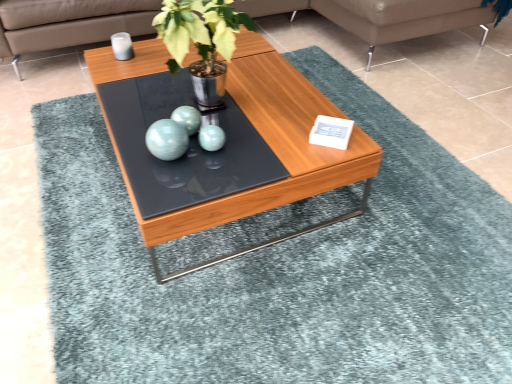
Where is `free point behind teal glossy sphere at center`? free point behind teal glossy sphere at center is located at coordinates [x=168, y=116].